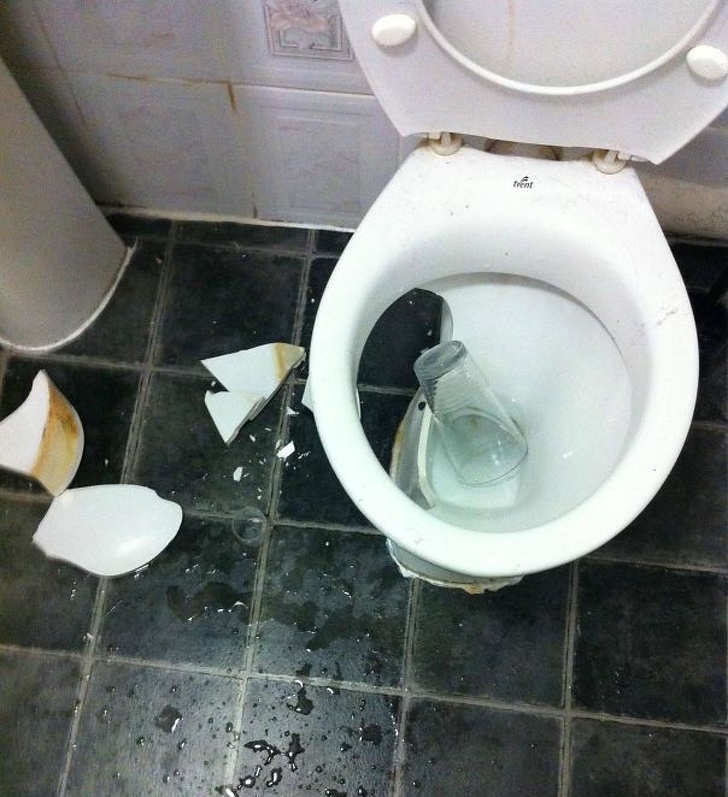
Find the location of a particular element. piece of broken toilet is located at coordinates (114, 528), (258, 370), (225, 417), (55, 434).